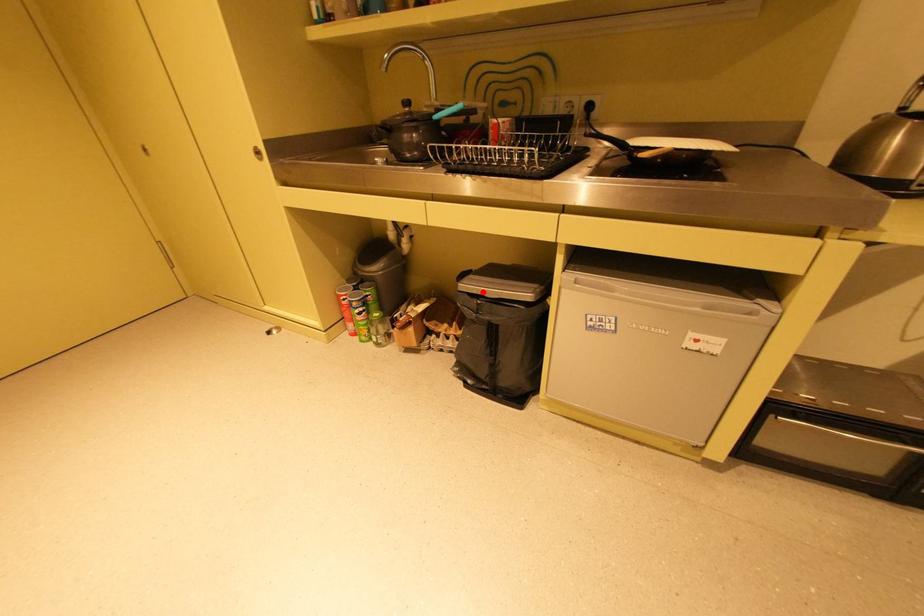
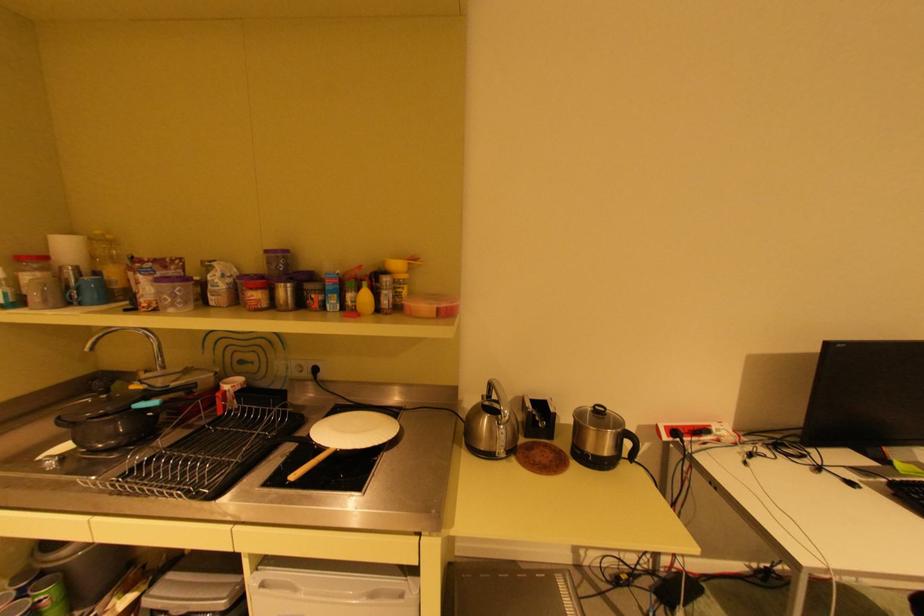
Where in the second image is the point corresponding to the highlighted location from the first image?

(168, 609)